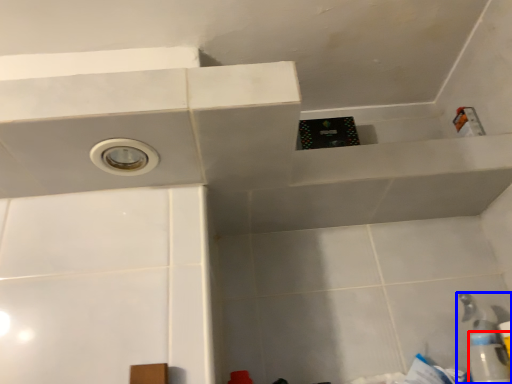
Question: Which of the following is the closest to the observer, bottle (highlighted by a red box) or plumbing fixture (highlighted by a blue box)?

Choices:
 (A) bottle
 (B) plumbing fixture

Answer: (A)